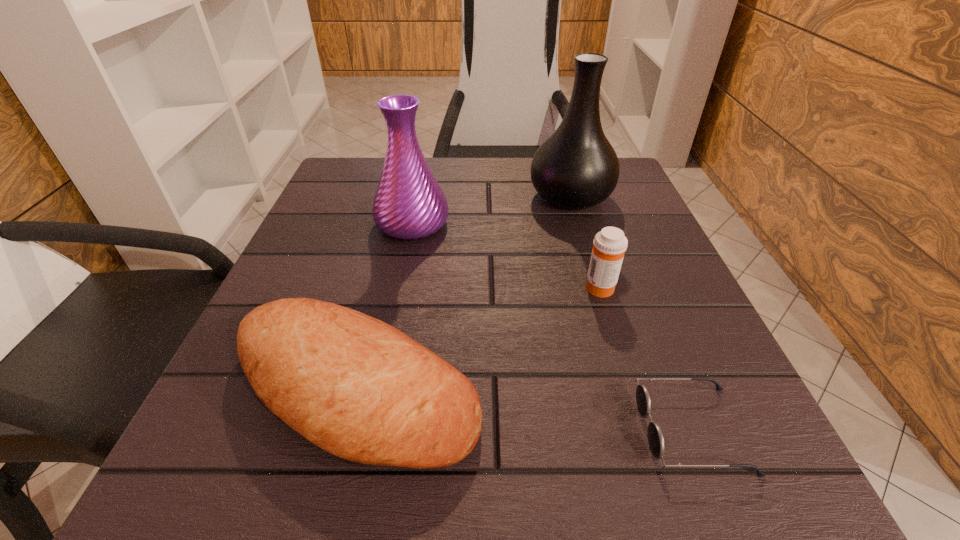
Locate an element on the screen. the second closest object to the third farthest object is located at coordinates (655, 436).

Locate an element on the screen. The width and height of the screenshot is (960, 540). vacant space that satisfies the following two spatial constraints: 1. on the front side of the second tallest object; 2. on the right side of the medicine is located at coordinates (399, 287).

I want to click on vacant area in the image that satisfies the following two spatial constraints: 1. on the back side of the right vase; 2. on the right side of the bread, so click(x=404, y=197).

Locate an element on the screen. The image size is (960, 540). free space that satisfies the following two spatial constraints: 1. on the front side of the shorter vase; 2. on the left side of the third farthest object is located at coordinates (399, 287).

Find the location of a particular element. Image resolution: width=960 pixels, height=540 pixels. vacant space that satisfies the following two spatial constraints: 1. on the back side of the right vase; 2. on the right side of the bread is located at coordinates (404, 197).